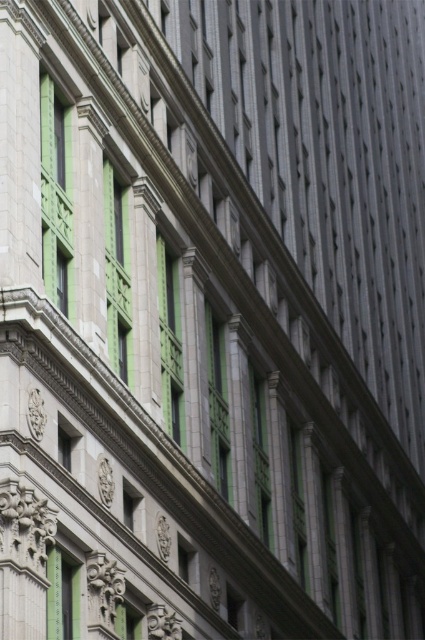
You are a window cleaner with a ladder that can extend up to 20 feet. You need to clean two windows on a building facade, the green glass window at upper left and the green glass window at center. Can you reach both windows with your current ladder without moving it?

The green glass window at upper left and the green glass window at center are 23.52 feet apart from each other. Since the ladder can only extend up to 20 feet, you cannot reach both windows without moving the ladder because the distance between them exceeds the ladder length.

You are standing in front of the building and notice two points marked on the facade. The first point is at coordinate point (51, 180) and the second is at point (124, 330). Which point is closer to you?

Point (51, 180) is in front of point (124, 330), so it is closer to you.

You are standing in front of a building and looking at the green glass window at upper left. If you want to take a photo of it with your smartphone camera, which has a maximum zoom range of 50 meters, will you be able to capture the window clearly without moving closer?

The green glass window at upper left is 57.25 meters away from camera, which exceeds the smartphone camera maximum zoom range of 50 meters. Therefore, you won not be able to capture the window clearly without moving closer.